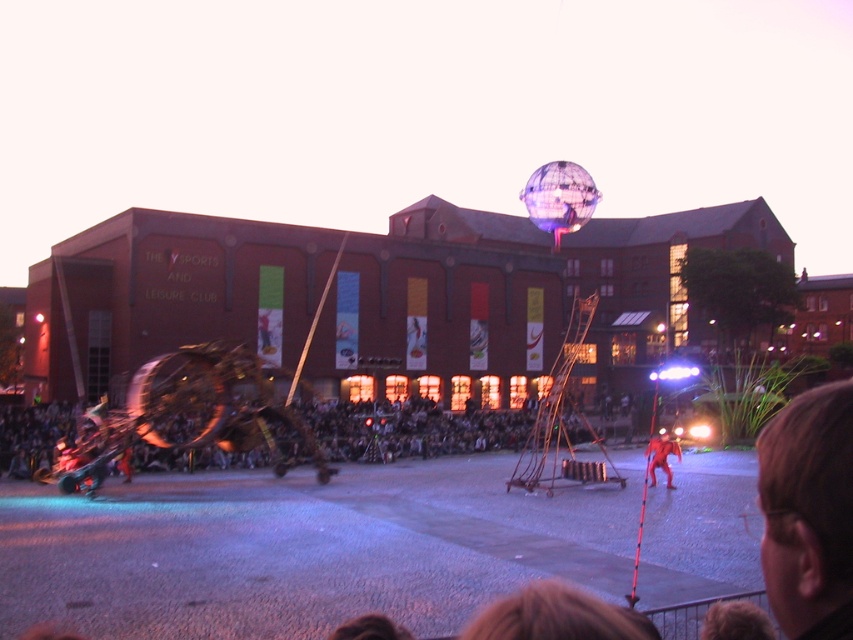
Question: Which of the following is the farthest from the observer?

Choices:
 (A) translucent purple sphere at upper center
 (B) red fabric person at center

Answer: (A)

Question: Which point is farther to the camera?

Choices:
 (A) (659, 458)
 (B) (573, 177)

Answer: (B)

Question: Does dark brown wooden bench at lower center have a larger size compared to translucent purple sphere at upper center?

Choices:
 (A) yes
 (B) no

Answer: (A)

Question: Which point appears closest to the camera in this image?

Choices:
 (A) (579, 195)
 (B) (666, 477)

Answer: (B)

Question: Is translucent purple sphere at upper center smaller than red fabric person at center?

Choices:
 (A) yes
 (B) no

Answer: (B)

Question: Is dark brown wooden bench at lower center to the left of translucent purple sphere at upper center from the viewer's perspective?

Choices:
 (A) yes
 (B) no

Answer: (A)